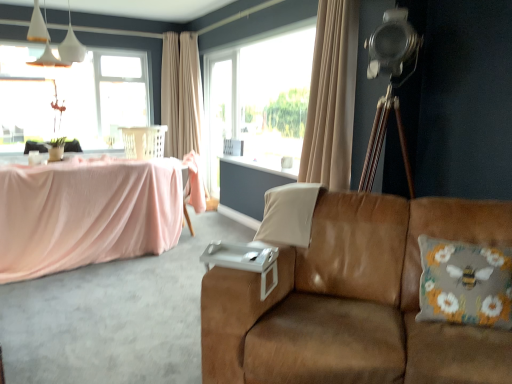
Question: From a real-world perspective, is transparent glass window at upper left beneath floral-patterned fabric pillow at right, which appears as the 2th pillow when viewed from the left?

Choices:
 (A) no
 (B) yes

Answer: (A)

Question: Can you confirm if transparent glass window at upper left is taller than floral-patterned fabric pillow at right, which appears as the 2th pillow when viewed from the left?

Choices:
 (A) no
 (B) yes

Answer: (B)

Question: Could you tell me if transparent glass window at upper left is turned towards floral-patterned fabric pillow at right, which ranks as the 2th pillow in back-to-front order?

Choices:
 (A) no
 (B) yes

Answer: (B)

Question: Is transparent glass window at upper left thinner than floral-patterned fabric pillow at right, the first pillow viewed from the right?

Choices:
 (A) no
 (B) yes

Answer: (B)

Question: Can you confirm if transparent glass window at upper left is bigger than floral-patterned fabric pillow at right, which ranks as the 2th pillow in back-to-front order?

Choices:
 (A) yes
 (B) no

Answer: (A)

Question: Is floral-patterned fabric pillow at right, the first pillow viewed from the right, bigger or smaller than transparent glass screen door at center?

Choices:
 (A) big
 (B) small

Answer: (B)

Question: From a real-world perspective, is floral-patterned fabric pillow at right, which appears as the 2th pillow when viewed from the left, above or below transparent glass screen door at center?

Choices:
 (A) above
 (B) below

Answer: (B)

Question: From the image's perspective, is floral-patterned fabric pillow at right, the 1th pillow in the front-to-back sequence, located above or below transparent glass screen door at center?

Choices:
 (A) below
 (B) above

Answer: (A)

Question: Is floral-patterned fabric pillow at right, which appears as the 2th pillow when viewed from the left, taller or shorter than transparent glass screen door at center?

Choices:
 (A) short
 (B) tall

Answer: (A)

Question: Looking at the image, does white matte pendant lights at upper left seem bigger or smaller compared to white fabric pillow at center, marked as the first pillow in a left-to-right arrangement?

Choices:
 (A) big
 (B) small

Answer: (A)

Question: Considering their positions, is white matte pendant lights at upper left located in front of or behind white fabric pillow at center, the 2th pillow positioned from the right?

Choices:
 (A) behind
 (B) front

Answer: (A)

Question: Is point (36, 59) closer or farther from the camera than point (308, 195)?

Choices:
 (A) farther
 (B) closer

Answer: (A)

Question: In terms of height, does white matte pendant lights at upper left look taller or shorter compared to white fabric pillow at center, the 2th pillow positioned from the right?

Choices:
 (A) short
 (B) tall

Answer: (B)

Question: Considering the positions of beige fabric curtain at upper center, the 1th curtain viewed from the front, and floral-patterned fabric pillow at right, the 1th pillow in the front-to-back sequence, in the image, is beige fabric curtain at upper center, the 1th curtain viewed from the front, taller or shorter than floral-patterned fabric pillow at right, the 1th pillow in the front-to-back sequence,?

Choices:
 (A) tall
 (B) short

Answer: (A)

Question: Is beige fabric curtain at upper center, positioned as the second curtain in back-to-front order, wider or thinner than floral-patterned fabric pillow at right, the first pillow viewed from the right?

Choices:
 (A) wide
 (B) thin

Answer: (B)